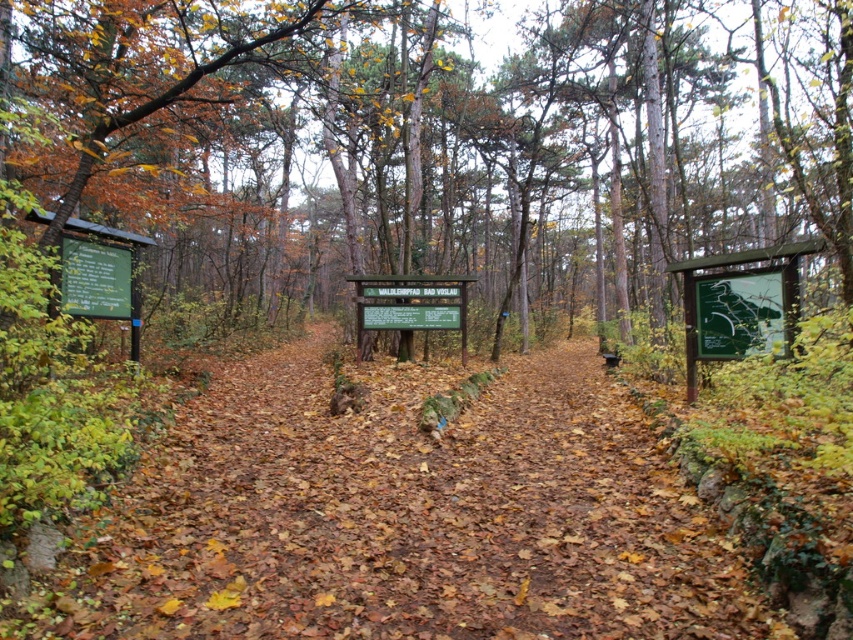
Can you confirm if brown leafy trail at center is positioned to the right of green matte sign at left?

Yes, brown leafy trail at center is to the right of green matte sign at left.

What are the coordinates of `brown leafy trail at center` in the screenshot? It's located at (402, 516).

Consider the image. Does brown wood sign at center have a larger size compared to brown leafy trail at center?

Correct, brown wood sign at center is larger in size than brown leafy trail at center.

Based on the photo, measure the distance between brown wood sign at center and brown leafy trail at center.

brown wood sign at center is 37.39 feet from brown leafy trail at center.

Between point (602, 230) and point (392, 602), which one is positioned in front?

Point (392, 602)

At what (x,y) coordinates should I click in order to perform the action: click on brown wood sign at center. Please return your answer as a coordinate pair (x, y). Image resolution: width=853 pixels, height=640 pixels. Looking at the image, I should click on (432, 145).

Can you confirm if brown wood sign at center is smaller than green matte sign at left?

Actually, brown wood sign at center might be larger than green matte sign at left.

Is point (271, 218) positioned after point (96, 262)?

Yes, point (271, 218) is behind point (96, 262).

This screenshot has height=640, width=853. What are the coordinates of `brown wood sign at center` in the screenshot? It's located at (432, 145).